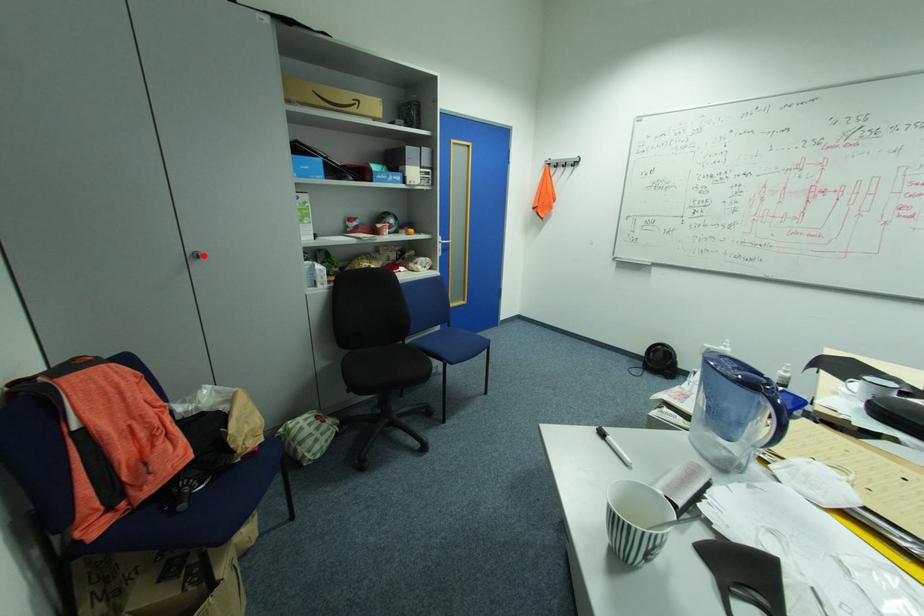
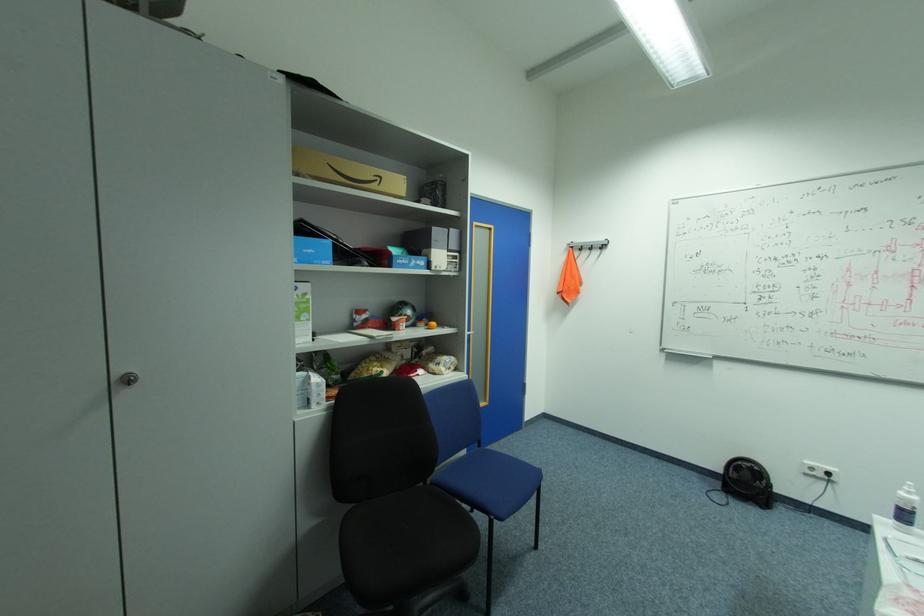
Locate, in the second image, the point that corresponds to the highlighted location in the first image.

(137, 379)